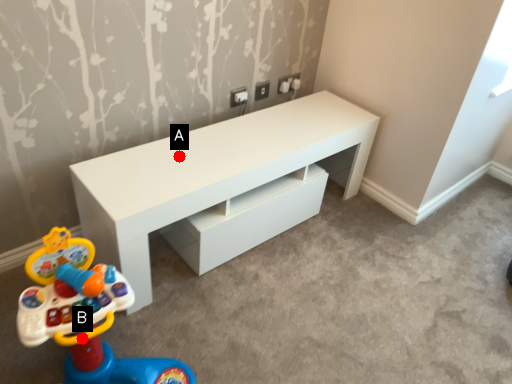
Question: Two points are circled on the image, labeled by A and B beside each circle. Which point is further to the camera?

Choices:
 (A) A is further
 (B) B is further

Answer: (A)